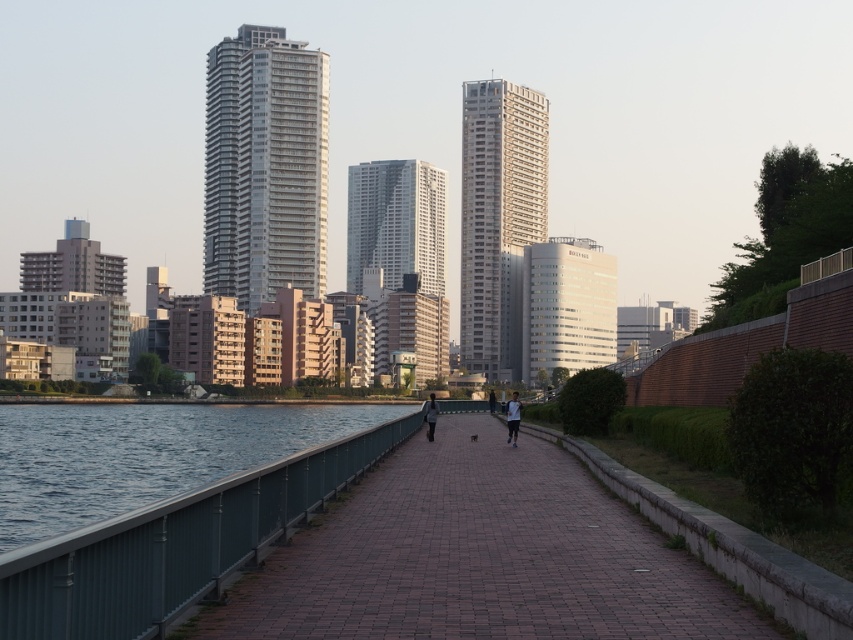
Is white smooth building at center to the left of light brown leather jacket at center from the viewer's perspective?

In fact, white smooth building at center is to the right of light brown leather jacket at center.

Which is behind, point (546, 307) or point (512, 413)?

The point (546, 307) is more distant.

What do you see at coordinates (567, 307) in the screenshot? I see `white smooth building at center` at bounding box center [567, 307].

Identify the location of white smooth building at center. (567, 307).

Is glassy metallic skyscraper at center to the right of dark gray fabric jacket at center from the viewer's perspective?

No, glassy metallic skyscraper at center is not to the right of dark gray fabric jacket at center.

Does glassy metallic skyscraper at center come behind dark gray fabric jacket at center?

Yes, glassy metallic skyscraper at center is behind dark gray fabric jacket at center.

Who is more forward, (257,173) or (434,420)?

Point (434,420) is in front.

The width and height of the screenshot is (853, 640). Find the location of `glassy metallic skyscraper at center`. glassy metallic skyscraper at center is located at coordinates (264, 166).

Between glossy glass building at center and light brown leather jacket at center, which one is positioned lower?

Positioned lower is light brown leather jacket at center.

The height and width of the screenshot is (640, 853). What do you see at coordinates (401, 259) in the screenshot?
I see `glossy glass building at center` at bounding box center [401, 259].

What are the coordinates of `glossy glass building at center` in the screenshot? It's located at coord(401,259).